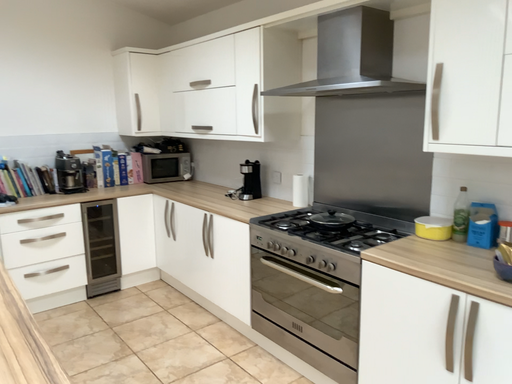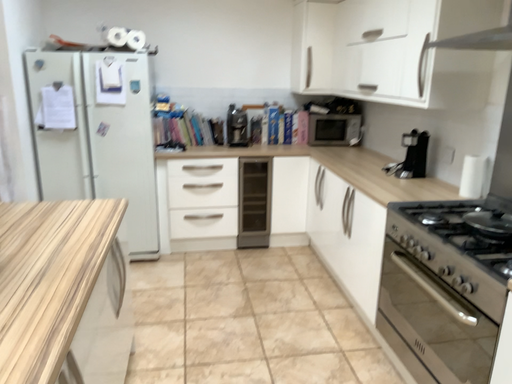
Question: Which way did the camera rotate in the video?

Choices:
 (A) rotated left
 (B) rotated right

Answer: (A)